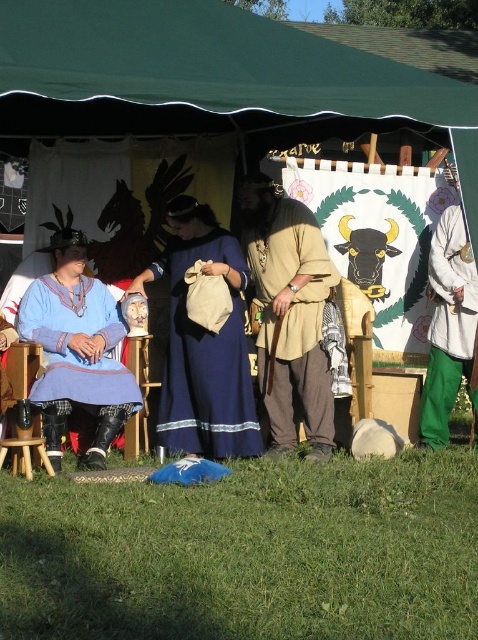
Which is below, green canvas tent at center or blue cotton dress at center?

blue cotton dress at center

Is point (264, 93) less distant than point (207, 387)?

Yes.

Locate an element on the screen. green canvas tent at center is located at coordinates (213, 77).

Who is taller, blue cotton dress at center or matte blue tunic at left?

With more height is blue cotton dress at center.

Who is positioned more to the right, blue cotton dress at center or matte blue tunic at left?

blue cotton dress at center

At what (x,y) coordinates should I click in order to perform the action: click on blue cotton dress at center. Please return your answer as a coordinate pair (x, y). This screenshot has height=640, width=478. Looking at the image, I should click on (206, 358).

You are a GUI agent. You are given a task and a screenshot of the screen. Output one action in this format:
    pyautogui.click(x=<x>, y=<y>)
    Task: Click on the blue cotton dress at center
    This screenshot has height=640, width=478.
    Given the screenshot: What is the action you would take?
    pyautogui.click(x=206, y=358)

Does matte blue tunic at left have a greater height compared to white cotton pants at right?

Incorrect, matte blue tunic at left's height is not larger of white cotton pants at right's.

Can you confirm if matte blue tunic at left is positioned to the right of white cotton pants at right?

Incorrect, matte blue tunic at left is not on the right side of white cotton pants at right.

What are the coordinates of `matte blue tunic at left` in the screenshot? It's located at (76, 349).